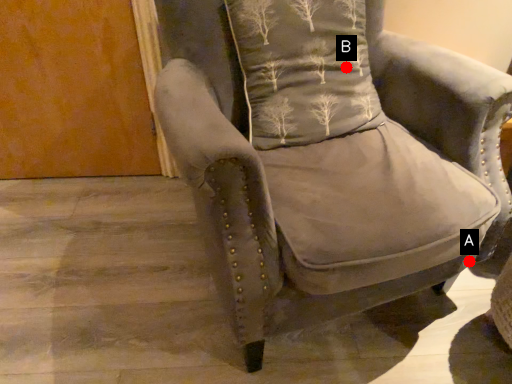
Question: Two points are circled on the image, labeled by A and B beside each circle. Among these points, which one is nearest to the camera?

Choices:
 (A) A is closer
 (B) B is closer

Answer: (A)